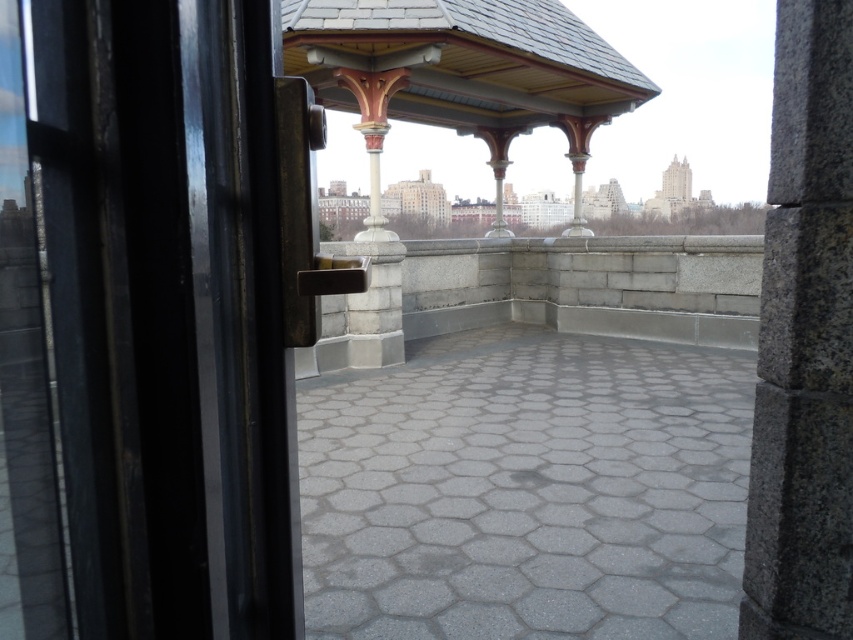
Does black glass door at left appear on the right side of granite pillar at right?

In fact, black glass door at left is to the left of granite pillar at right.

Who is taller, black glass door at left or granite pillar at right?

granite pillar at right

In the scene shown: Who is more distant from viewer, (68, 502) or (833, 236)?

The point (833, 236) is more distant.

The image size is (853, 640). Find the location of `black glass door at left`. black glass door at left is located at coordinates (144, 321).

Which of these two, polished bronze column at center or polished stone column at center, stands shorter?

Standing shorter between the two is polished stone column at center.

Is point (572, 148) positioned after point (508, 134)?

No.

Identify the location of polished bronze column at center. The image size is (853, 640). (578, 163).

The image size is (853, 640). In order to click on polished bronze column at center in this screenshot , I will do `click(578, 163)`.

Can you confirm if wooden gazebo at center is thinner than polished stone column at center?

Yes, wooden gazebo at center is thinner than polished stone column at center.

Does wooden gazebo at center appear on the left side of polished stone column at center?

Yes, wooden gazebo at center is to the left of polished stone column at center.

Is point (361, 60) farther from camera compared to point (490, 228)?

No, (361, 60) is in front of (490, 228).

Image resolution: width=853 pixels, height=640 pixels. I want to click on wooden gazebo at center, so coord(461,74).